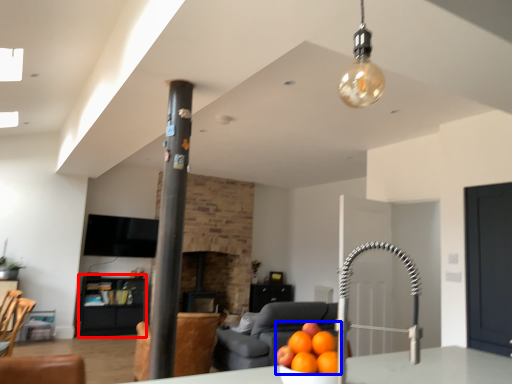
Question: Which object is closer to the camera taking this photo, furniture (highlighted by a red box) or orange (highlighted by a blue box)?

Choices:
 (A) furniture
 (B) orange

Answer: (B)